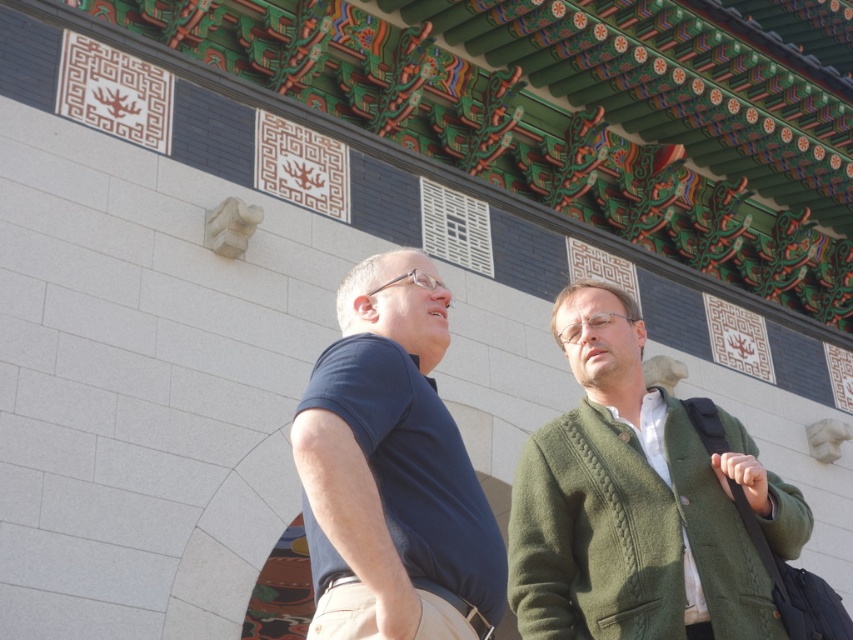
Is green knitted sweater at right thinner than dark blue shirt at center?

Indeed, green knitted sweater at right has a lesser width compared to dark blue shirt at center.

Does green knitted sweater at right appear on the right side of dark blue shirt at center?

Indeed, green knitted sweater at right is positioned on the right side of dark blue shirt at center.

Between point (583, 451) and point (367, 483), which one is positioned behind?

The point (583, 451) is more distant.

Locate an element on the screen. green knitted sweater at right is located at coordinates point(637,502).